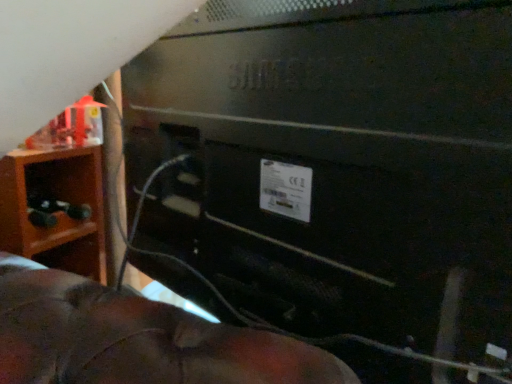
Find the location of `brown wood nightstand at left`. brown wood nightstand at left is located at coordinates (92, 209).

This screenshot has width=512, height=384. I want to click on matte black toy at left, so click(x=54, y=210).

Is matte black toy at left at the back of brown wood nightstand at left?

No, brown wood nightstand at left's orientation is not away from matte black toy at left.

Considering the positions of objects brown wood nightstand at left and matte black toy at left in the image provided, who is more to the right, brown wood nightstand at left or matte black toy at left?

From the viewer's perspective, matte black toy at left appears more on the right side.

Is brown wood nightstand at left shorter than matte black toy at left?

In fact, brown wood nightstand at left may be taller than matte black toy at left.

Looking at this image, measure the distance from black matte wire at center to matte black toy at left.

black matte wire at center and matte black toy at left are 38.60 centimeters apart from each other.

From a real-world perspective, between black matte wire at center and matte black toy at left, who is vertically lower?

matte black toy at left, from a real-world perspective.

Is black matte wire at center wider or thinner than matte black toy at left?

Clearly, black matte wire at center has less width compared to matte black toy at left.

From a real-world perspective, is matte black toy at left on top of black matte wire at center?

No, from a real-world perspective, matte black toy at left is not over black matte wire at center

Based on their positions, is matte black toy at left located to the left or right of black matte wire at center?

Based on their positions, matte black toy at left is located to the left of black matte wire at center.

I want to click on wire on the right side of matte black toy at left, so click(x=336, y=334).

From their relative heights in the image, would you say brown wood nightstand at left is taller or shorter than black matte wire at center?

Considering their sizes, brown wood nightstand at left has less height than black matte wire at center.

Is brown wood nightstand at left next to black matte wire at center and touching it?

brown wood nightstand at left and black matte wire at center are not in contact.

Identify the location of wire above the brown wood nightstand at left (from a real-world perspective). The height and width of the screenshot is (384, 512). (336, 334).

Can you confirm if brown wood nightstand at left is bigger than black matte wire at center?

No.

Is matte black toy at left looking in the opposite direction of brown wood nightstand at left?

Absolutely, matte black toy at left is directed away from brown wood nightstand at left.

From a real-world perspective, is matte black toy at left physically located above or below brown wood nightstand at left?

From a real-world perspective, matte black toy at left is physically above brown wood nightstand at left.

Which is closer, (34, 205) or (57, 246)?

The point (34, 205) is in front.

Considering the relative positions of matte black toy at left and brown wood nightstand at left in the image provided, is matte black toy at left to the left of brown wood nightstand at left from the viewer's perspective?

In fact, matte black toy at left is to the right of brown wood nightstand at left.

Considering the sizes of objects black matte wire at center and brown wood nightstand at left in the image provided, who is bigger, black matte wire at center or brown wood nightstand at left?

With larger size is black matte wire at center.

Is black matte wire at center taller or shorter than brown wood nightstand at left?

In the image, black matte wire at center appears to be taller than brown wood nightstand at left.

From the image's perspective, does black matte wire at center appear lower than brown wood nightstand at left?

No.

Between black matte wire at center and brown wood nightstand at left, which one is positioned in front?

black matte wire at center is in front.

This screenshot has height=384, width=512. What are the coordinates of `toy above the brown wood nightstand at left (from the image's perspective)` in the screenshot? It's located at (54, 210).

The width and height of the screenshot is (512, 384). What are the coordinates of `wire above the matte black toy at left (from a real-world perspective)` in the screenshot? It's located at (336, 334).

Based on their spatial positions, is matte black toy at left or brown wood nightstand at left further from black matte wire at center?

Among the two, matte black toy at left is located further to black matte wire at center.

From the image, which object appears to be nearer to black matte wire at center, brown wood nightstand at left or matte black toy at left?

The object closer to black matte wire at center is brown wood nightstand at left.

Which object lies further to the anchor point brown wood nightstand at left, black matte wire at center or matte black toy at left?

Among the two, black matte wire at center is located further to brown wood nightstand at left.

From the image, which object appears to be nearer to matte black toy at left, brown wood nightstand at left or black matte wire at center?

The object closer to matte black toy at left is brown wood nightstand at left.

Estimate the real-world distances between objects in this image. Which object is further from matte black toy at left, black matte wire at center or brown wood nightstand at left?

black matte wire at center is further to matte black toy at left.

Looking at the image, which one is located closer to brown wood nightstand at left, matte black toy at left or black matte wire at center?

matte black toy at left.

Find the location of `toy between brown wood nightstand at left and black matte wire at center`. toy between brown wood nightstand at left and black matte wire at center is located at coordinates pos(54,210).